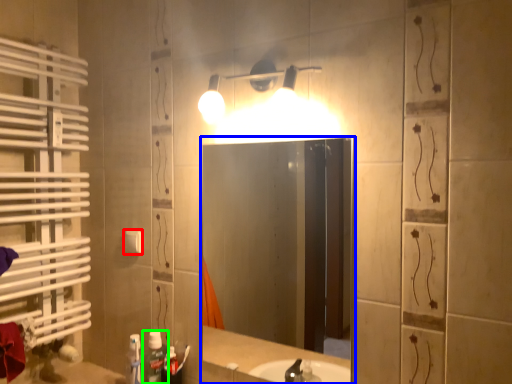
Question: Based on their relative distances, which object is farther from light switch (highlighted by a red box)? Choose from mirror (highlighted by a blue box) and bottle (highlighted by a green box).

Choices:
 (A) mirror
 (B) bottle

Answer: (A)